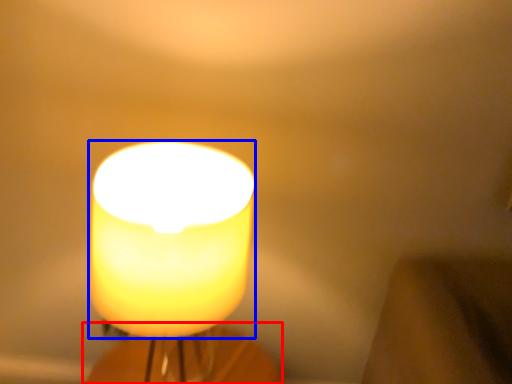
Question: Which object appears farthest to the camera in this image, candle holder (highlighted by a red box) or candle (highlighted by a blue box)?

Choices:
 (A) candle holder
 (B) candle

Answer: (A)